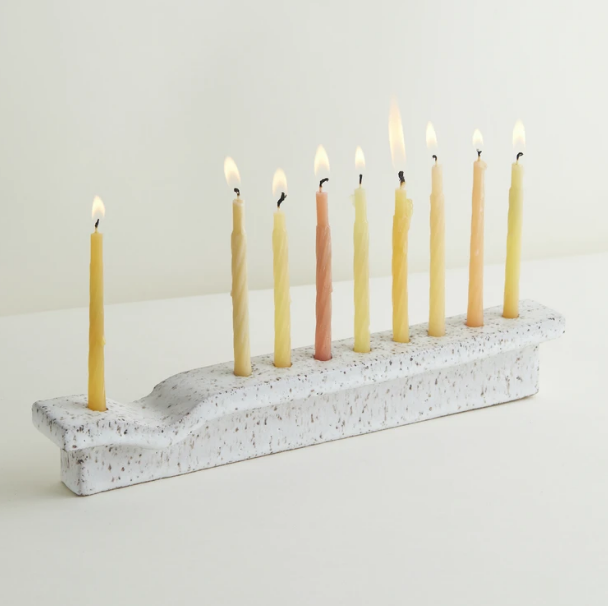
At what (x,y) coordinates should I click in order to perform the action: click on candle. Please return your answer as a coordinate pair (x, y). Image resolution: width=608 pixels, height=606 pixels. Looking at the image, I should click on (240, 230), (281, 230).